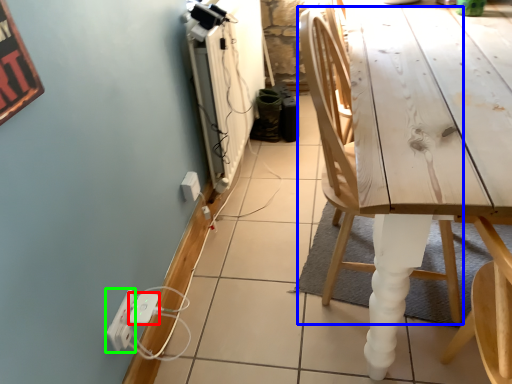
Question: Estimate the real-world distances between objects in this image. Which object is closer to extension cord (highlighted by a red box), chair (highlighted by a blue box) or electric outlet (highlighted by a green box)?

Choices:
 (A) chair
 (B) electric outlet

Answer: (B)